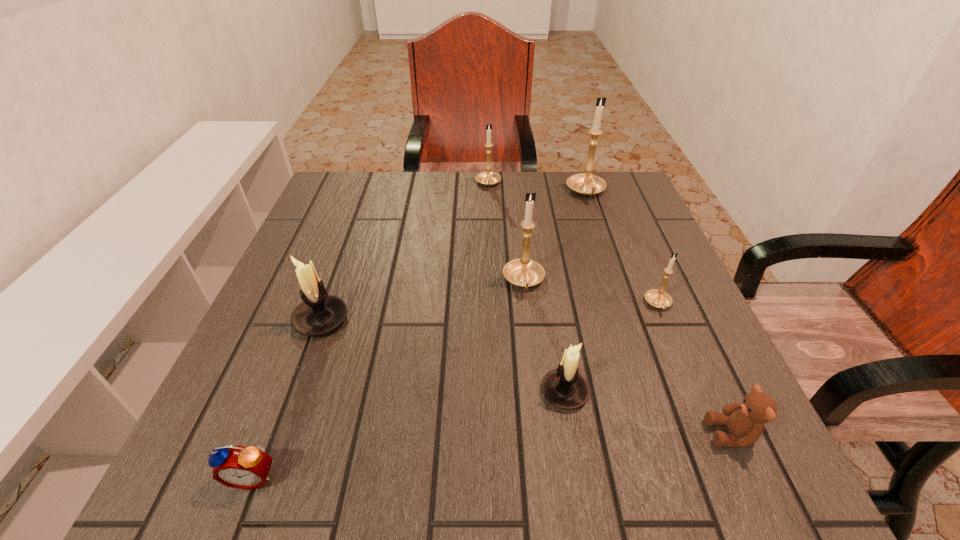
The width and height of the screenshot is (960, 540). Find the location of `the seventh farthest object`. the seventh farthest object is located at coordinates (745, 421).

Locate an element on the screen. teddy bear is located at coordinates (745, 421).

I want to click on the nearest object, so click(240, 467).

This screenshot has height=540, width=960. What are the coordinates of `alarm clock` in the screenshot? It's located at (240, 467).

The width and height of the screenshot is (960, 540). In order to click on blank area located 0.250m on the handle side of the tallest candle holder in this screenshot , I will do `click(612, 269)`.

Find the location of a particular element. This screenshot has width=960, height=540. vacant space located 0.080m on the handle side of the fifth shortest candle holder is located at coordinates (529, 330).

I want to click on vacant space situated 0.080m on the handle side of the second smallest gold candle holder, so click(489, 208).

Locate an element on the screen. This screenshot has width=960, height=540. vacant space located 0.210m on the right of the leftmost candle holder is located at coordinates (457, 320).

The image size is (960, 540). What are the coordinates of `vacant area located 0.340m on the handle side of the smallest gold candle holder` in the screenshot? It's located at (739, 498).

The height and width of the screenshot is (540, 960). Identify the location of vacant region located 0.150m on the back of the third nearest object. (551, 309).